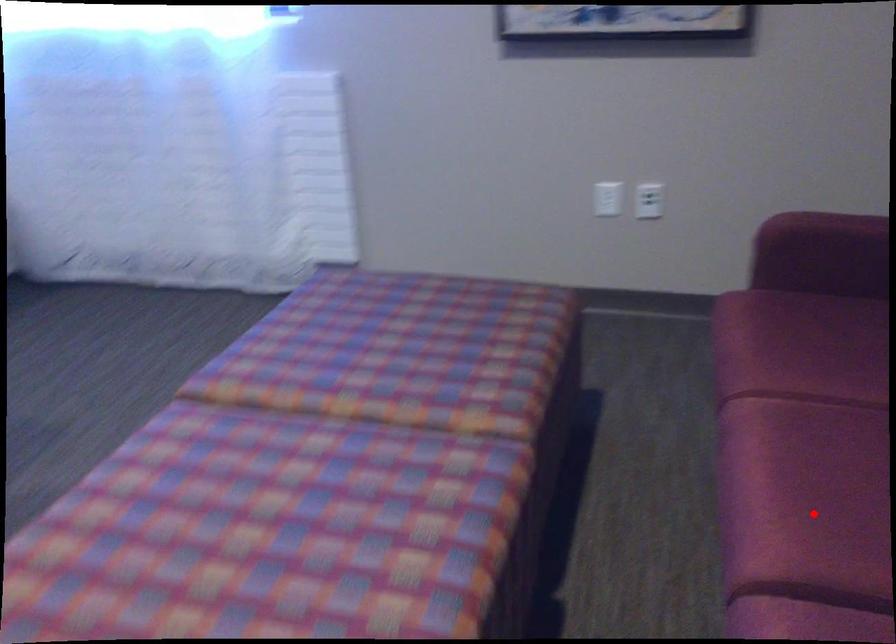
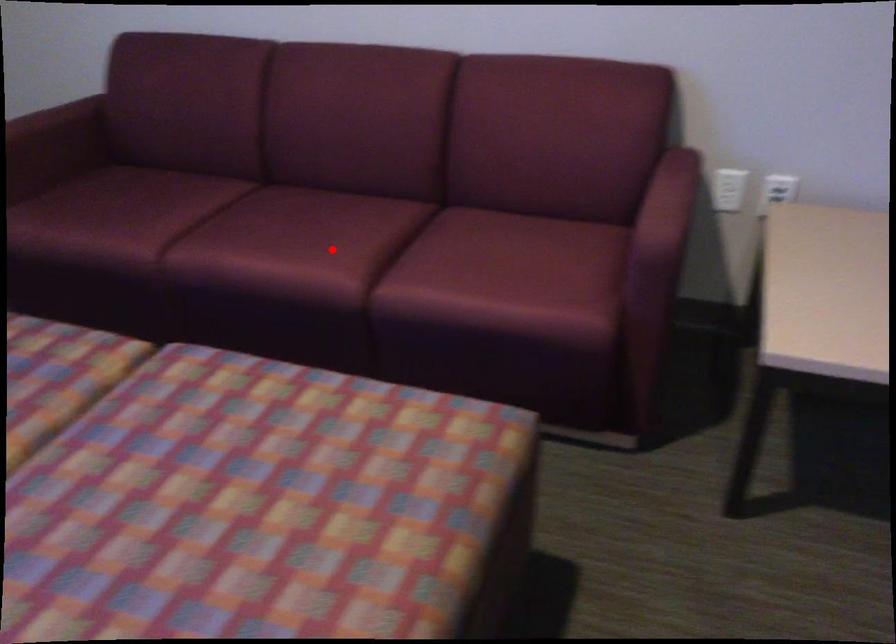
I am providing you with two images of the same scene from different viewpoints. A red point is marked on the first image and another point is marked on the second image. Do the highlighted points in image1 and image2 indicate the same real-world spot?

Yes